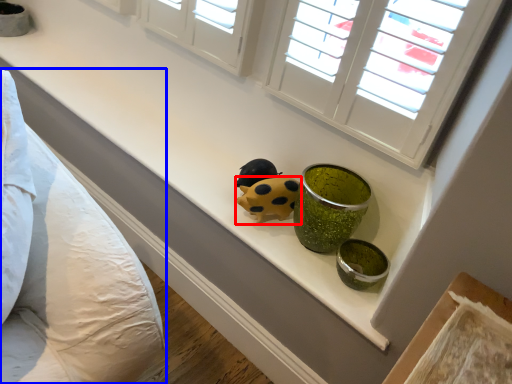
Question: Among these objects, which one is nearest to the camera, ladybug (highlighted by a red box) or bedding (highlighted by a blue box)?

Choices:
 (A) ladybug
 (B) bedding

Answer: (B)